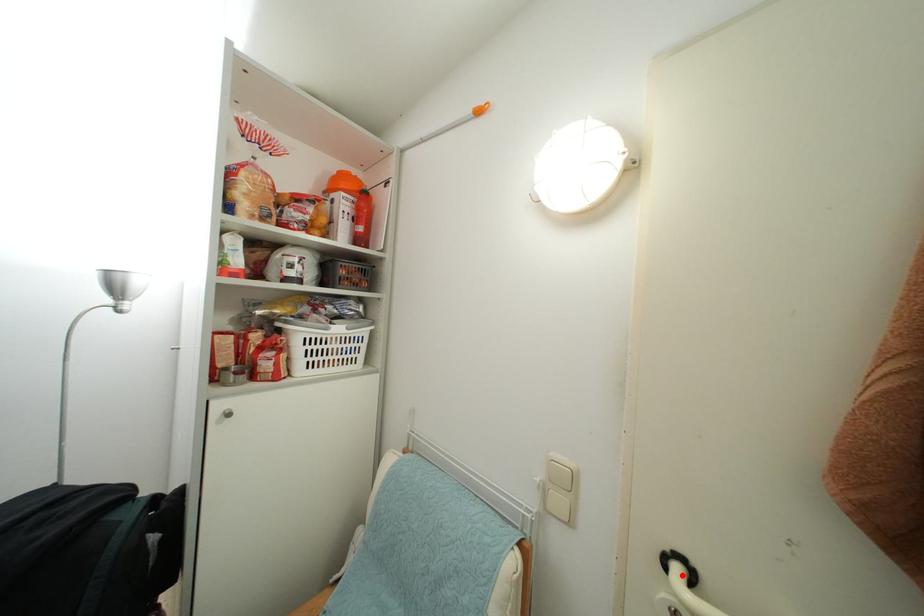
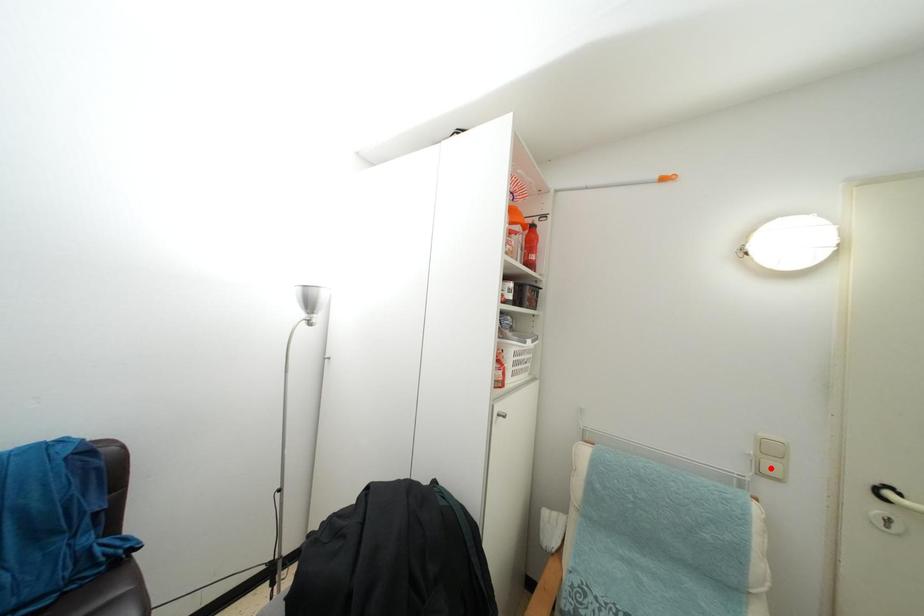
I am providing you with two images of the same scene from different viewpoints. A red point is marked on the first image and another point is marked on the second image. Do the highlighted points in image1 and image2 indicate the same real-world spot?

No